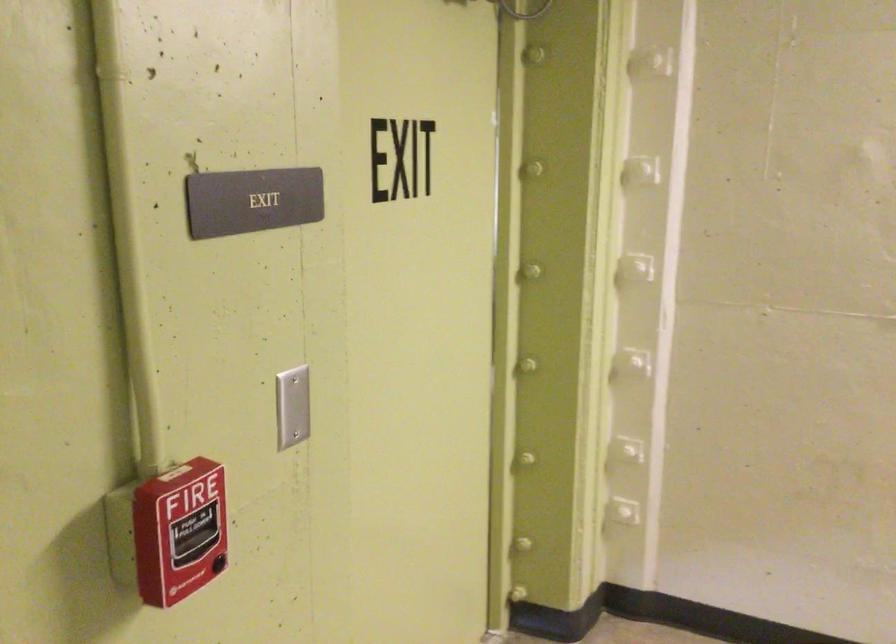
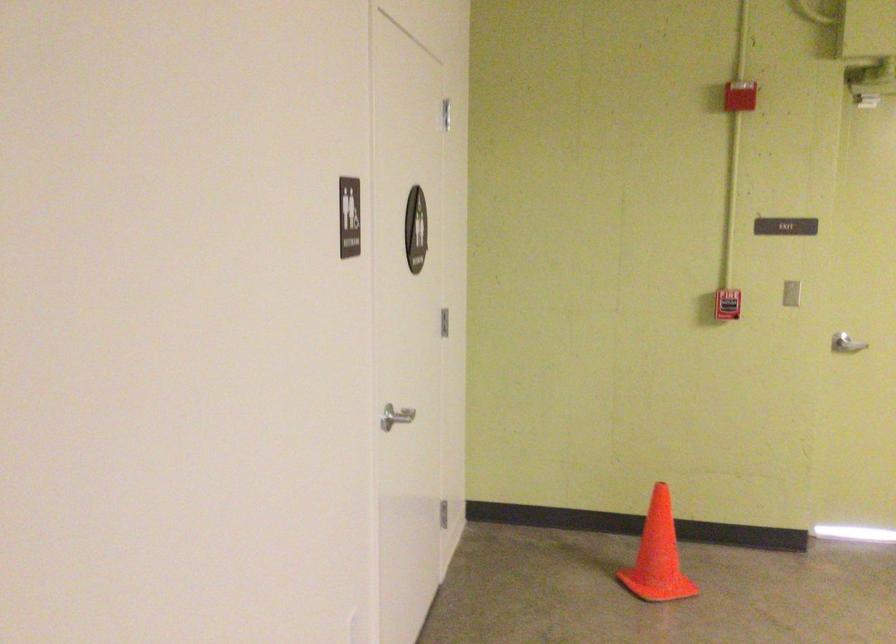
In the second image, find the point that corresponds to the point at 291,418 in the first image.

(790, 292)